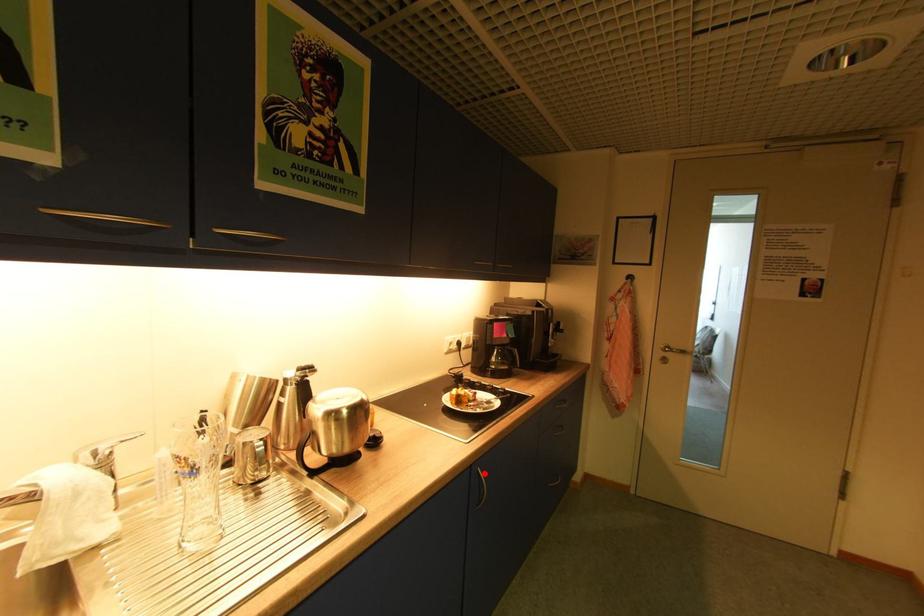
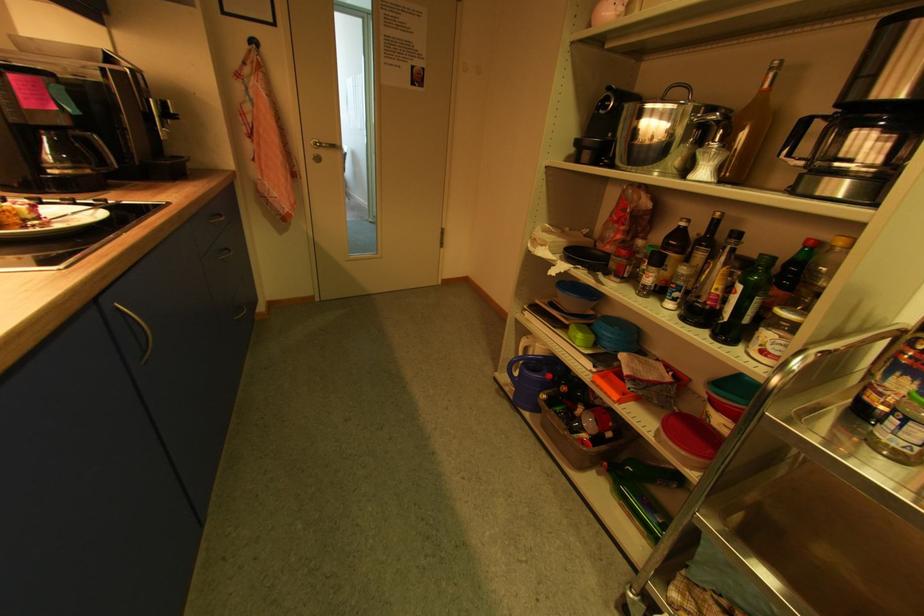
Question: I am providing you with two images of the same scene from different viewpoints. In image1, a red point is highlighted. Considering the same 3D point in image2, which of the following is correct?

Choices:
 (A) It is closer
 (B) It is farther

Answer: (A)